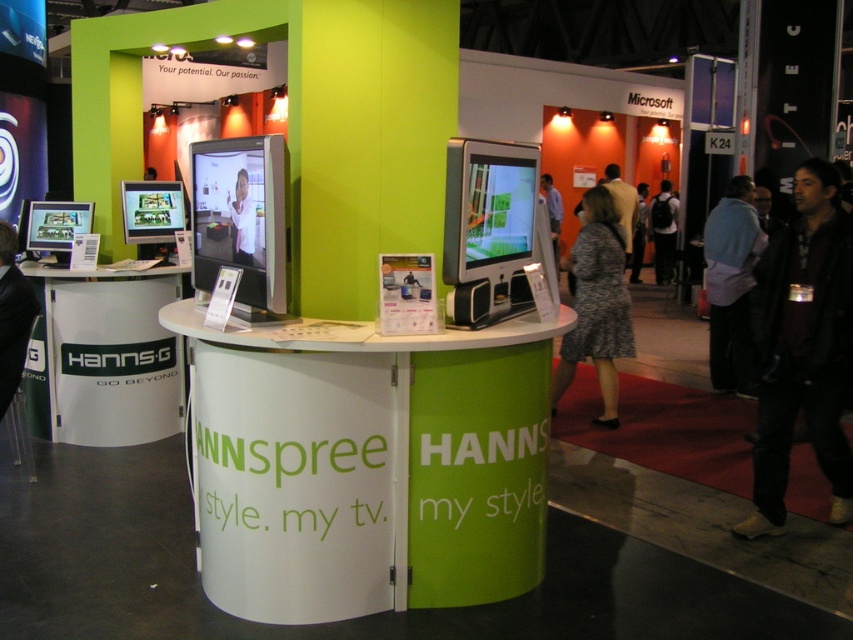
Question: Is the position of dark brown leather jacket at lower right more distant than that of matte black monitor at left?

Choices:
 (A) no
 (B) yes

Answer: (A)

Question: Can you confirm if dark brown leather jacket at lower right is wider than black backpack at center?

Choices:
 (A) no
 (B) yes

Answer: (B)

Question: From the image, what is the correct spatial relationship of blue fabric jacket at right in relation to black backpack at center?

Choices:
 (A) left
 (B) right

Answer: (A)

Question: Which object is farther from the camera taking this photo?

Choices:
 (A) blue fabric jacket at right
 (B) matte black monitor at left
 (C) black backpack at center
 (D) dark brown leather jacket at lower right

Answer: (C)

Question: Which object is the closest to the patterned fabric dress at center?

Choices:
 (A) matte black monitor at left
 (B) blue fabric jacket at right
 (C) black backpack at center
 (D) dark brown leather jacket at lower right

Answer: (B)

Question: Which of these objects is positioned farthest from the dark brown leather jacket at lower right?

Choices:
 (A) blue fabric jacket at right
 (B) matte black monitor at left
 (C) black backpack at center

Answer: (C)